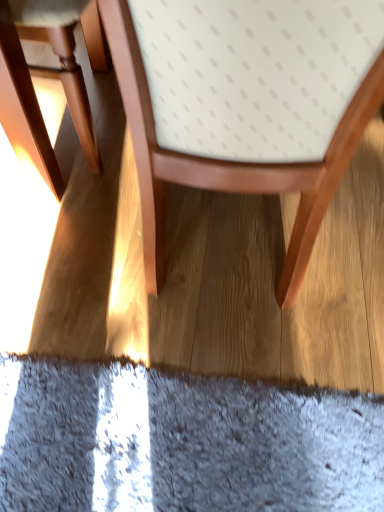
Question: Is matte wood chair at left, which is the 1th chair in left-to-right order, inside the boundaries of wooden chair at center, the 1th chair when ordered from right to left, or outside?

Choices:
 (A) inside
 (B) outside

Answer: (B)

Question: From the image's perspective, is matte wood chair at left, which is the 1th chair in left-to-right order, above or below wooden chair at center, the 1th chair when ordered from right to left?

Choices:
 (A) below
 (B) above

Answer: (B)

Question: In terms of width, does matte wood chair at left, which is the 1th chair in left-to-right order, look wider or thinner when compared to wooden chair at center, the second chair in the left-to-right sequence?

Choices:
 (A) wide
 (B) thin

Answer: (B)

Question: In the image, is wooden chair at center, the 1th chair when ordered from right to left, on the left side or the right side of matte wood chair at left, placed as the second chair when sorted from right to left?

Choices:
 (A) left
 (B) right

Answer: (B)

Question: Does point (347, 18) appear closer or farther from the camera than point (69, 54)?

Choices:
 (A) farther
 (B) closer

Answer: (B)

Question: Considering the positions of wooden chair at center, the second chair in the left-to-right sequence, and matte wood chair at left, which is the 1th chair in left-to-right order, in the image, is wooden chair at center, the second chair in the left-to-right sequence, taller or shorter than matte wood chair at left, which is the 1th chair in left-to-right order,?

Choices:
 (A) tall
 (B) short

Answer: (A)

Question: Considering the positions of wooden chair at center, the 1th chair when ordered from right to left, and matte wood chair at left, which is the 1th chair in left-to-right order, in the image, is wooden chair at center, the 1th chair when ordered from right to left, bigger or smaller than matte wood chair at left, which is the 1th chair in left-to-right order,?

Choices:
 (A) big
 (B) small

Answer: (A)